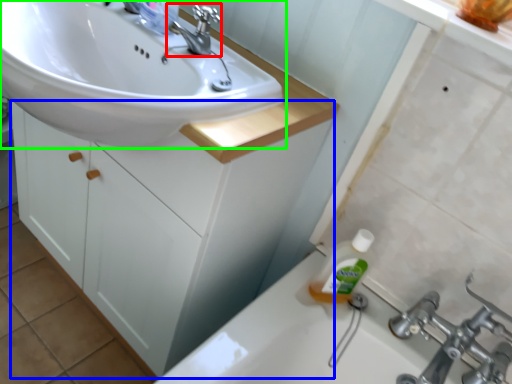
Question: Considering the real-world distances, which object is closest to tap (highlighted by a red box)? bathroom cabinet (highlighted by a blue box) or sink (highlighted by a green box).

Choices:
 (A) bathroom cabinet
 (B) sink

Answer: (B)